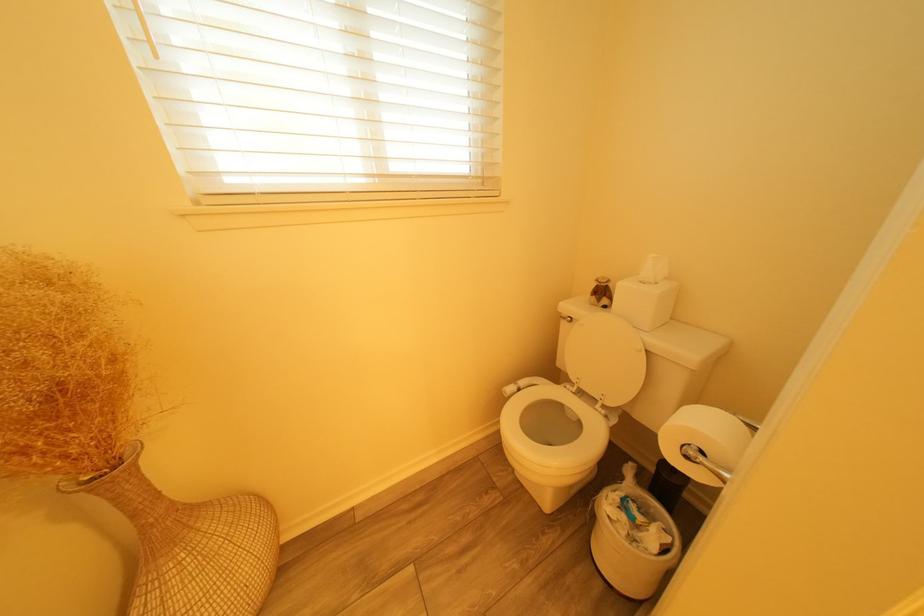
Where is `white toilet lid`? white toilet lid is located at coordinates (602, 355).